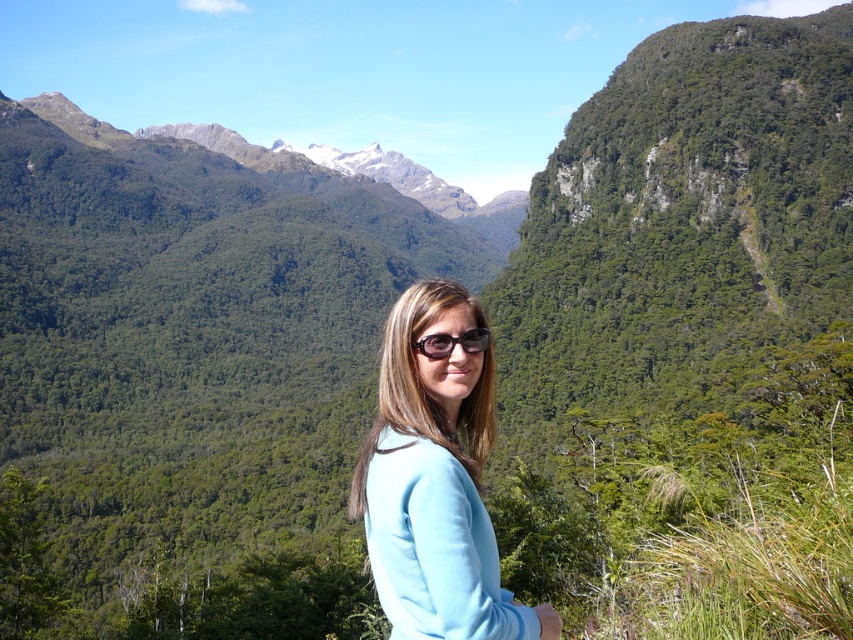
Is point (486, 396) farther from camera compared to point (469, 333)?

Yes, it is.

Describe the element at coordinates (436, 480) in the screenshot. Image resolution: width=853 pixels, height=640 pixels. I see `light blue fabric at center` at that location.

Describe the element at coordinates (436, 480) in the screenshot. The image size is (853, 640). I see `light blue fabric at center` at that location.

I want to click on light blue fabric at center, so click(436, 480).